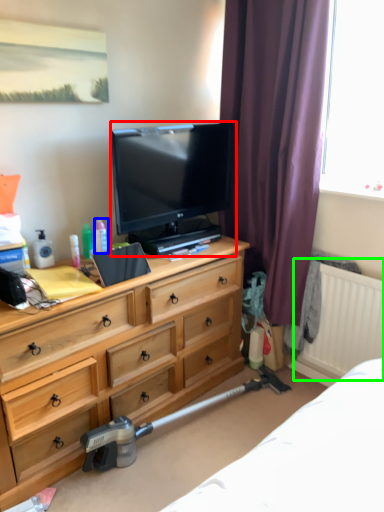
Question: Estimate the real-world distances between objects in this image. Which object is closer to television (highlighted by a red box), toiletry (highlighted by a blue box) or radiator (highlighted by a green box)?

Choices:
 (A) toiletry
 (B) radiator

Answer: (A)